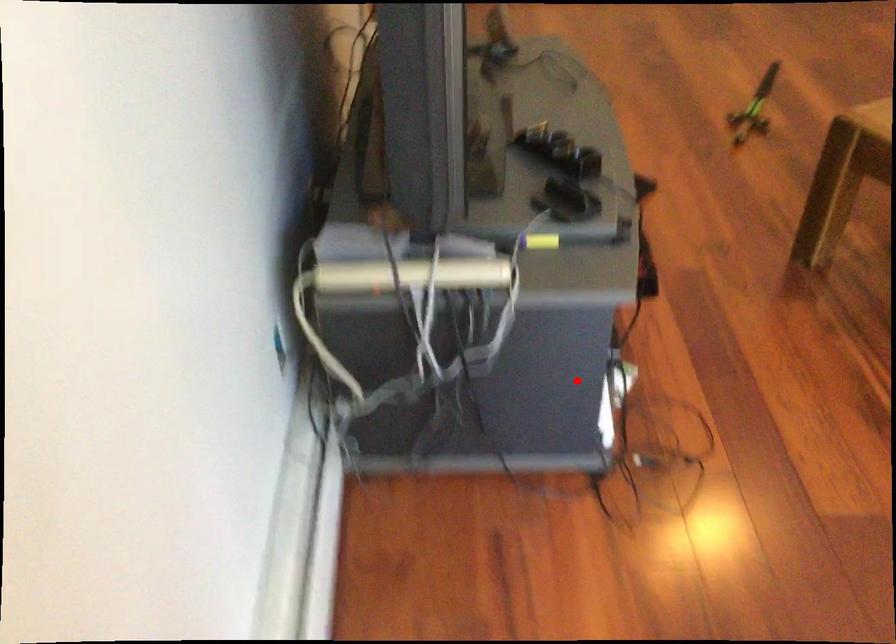
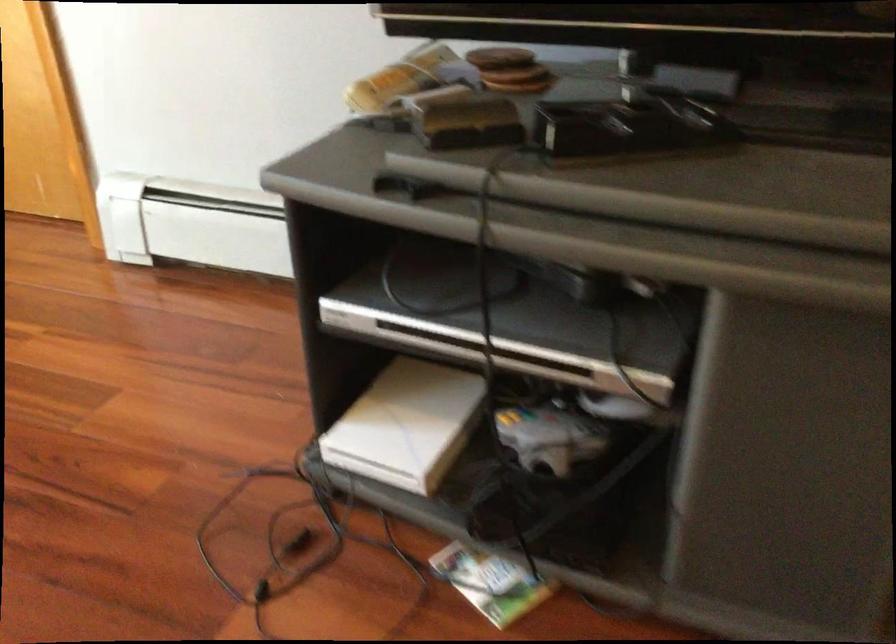
Find the pixel in the second image that matches the highlighted location in the first image.

(407, 424)